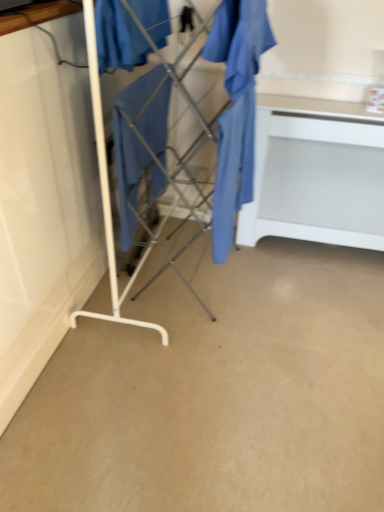
The width and height of the screenshot is (384, 512). What are the coordinates of `vacant region below white matte table at center (from a real-world perspective)` in the screenshot? It's located at (322, 253).